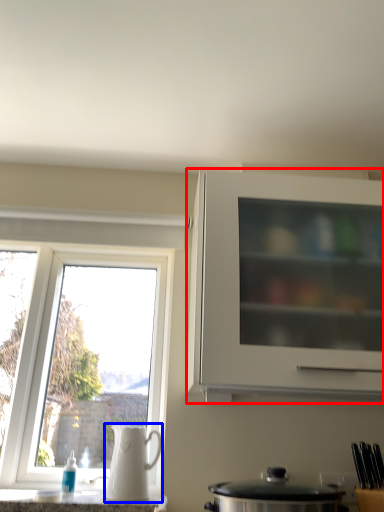
Question: Among these objects, which one is farthest to the camera, cabinetry (highlighted by a red box) or jug (highlighted by a blue box)?

Choices:
 (A) cabinetry
 (B) jug

Answer: (B)